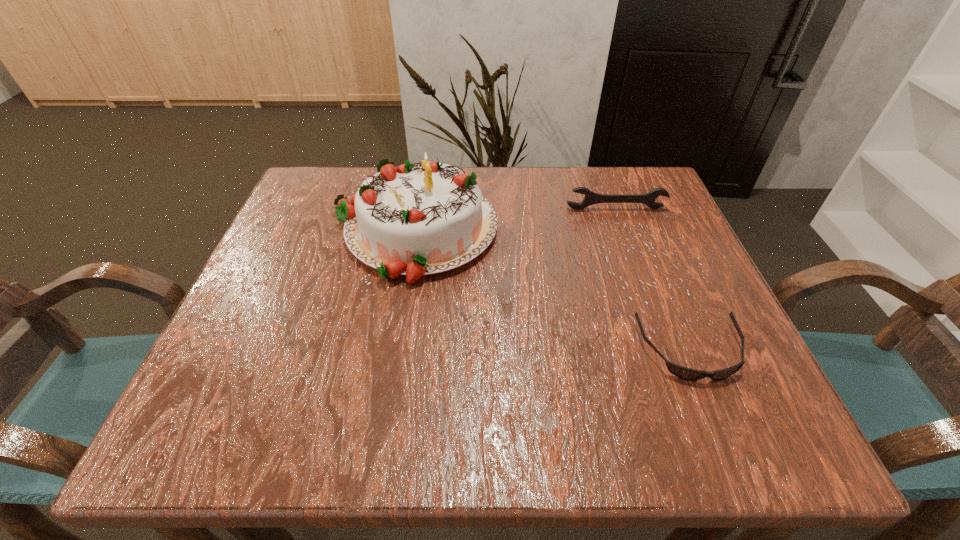
Identify the location of cake. The width and height of the screenshot is (960, 540). (414, 220).

The image size is (960, 540). What are the coordinates of `the leftmost object` in the screenshot? It's located at (414, 220).

The width and height of the screenshot is (960, 540). In order to click on wrench in this screenshot , I will do `click(591, 198)`.

The width and height of the screenshot is (960, 540). What are the coordinates of `the shortest object` in the screenshot? It's located at (688, 374).

This screenshot has height=540, width=960. Identify the location of the nearest object. pyautogui.click(x=688, y=374).

This screenshot has width=960, height=540. What are the coordinates of `blank space located on the front of the tallest object` in the screenshot? It's located at (383, 409).

Locate an element on the screen. This screenshot has width=960, height=540. vacant space located 0.210m on the open ends of the second shortest object is located at coordinates (639, 274).

I want to click on cake situated at the far edge, so click(414, 220).

This screenshot has width=960, height=540. Find the location of `wrench at the far edge`. wrench at the far edge is located at coordinates (591, 198).

Where is `object that is at the left edge`? object that is at the left edge is located at coordinates (414, 220).